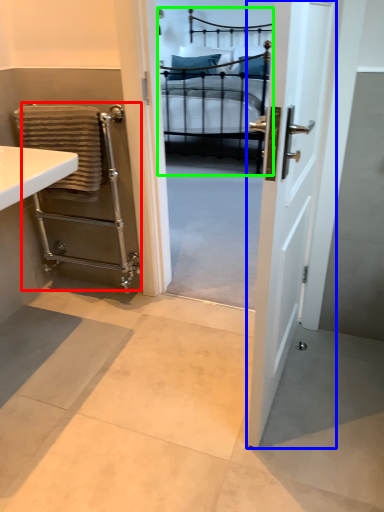
Question: Which object is positioned closest to balustrade (highlighted by a red box)? Select from door (highlighted by a blue box) and bed (highlighted by a green box).

Choices:
 (A) door
 (B) bed

Answer: (A)